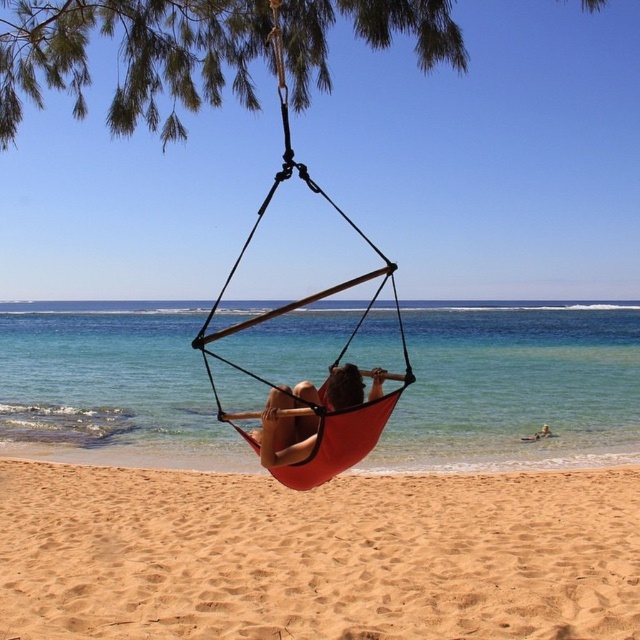
You are standing on the sandy yellow at lower center and want to walk to the clear blue water at center. Which direction should you head towards?

Since the sandy yellow at lower center is to the left of clear blue water at center, you should head to the right to reach the clear blue water at center.

You are planning to take a photo of the beach scene. The clear blue water at center and the matte orange hammock at center are both in your viewfinder. Which object should you focus on if you want to capture the larger subject in your photo?

The clear blue water at center is bigger than the matte orange hammock at center, so you should focus on the clear blue water at center to capture the larger subject in your photo.